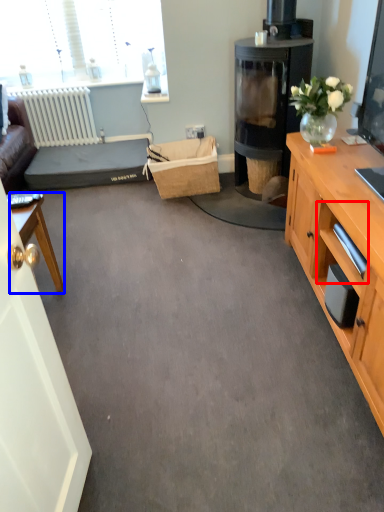
Question: Among these objects, which one is farthest to the camera, drawer (highlighted by a red box) or desk (highlighted by a blue box)?

Choices:
 (A) drawer
 (B) desk

Answer: (B)